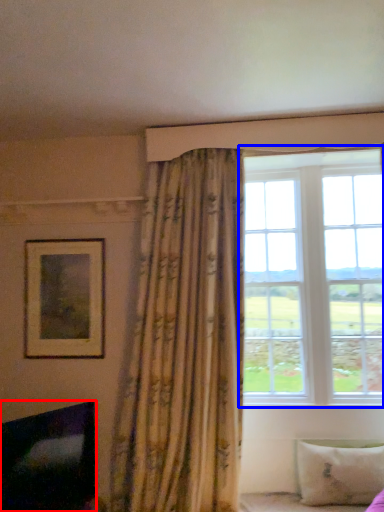
Question: Which object appears closest to the camera in this image, fireplace (highlighted by a red box) or window (highlighted by a blue box)?

Choices:
 (A) fireplace
 (B) window

Answer: (A)